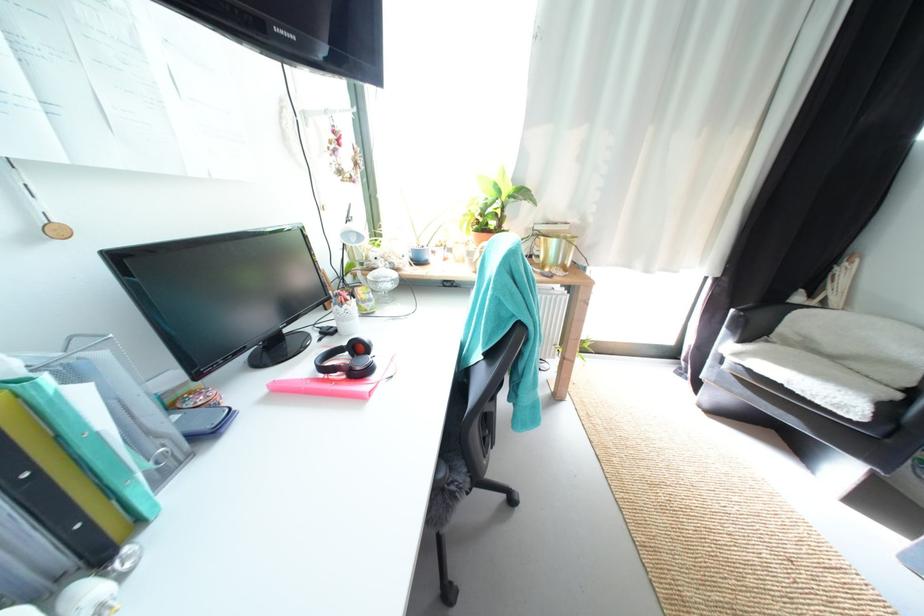
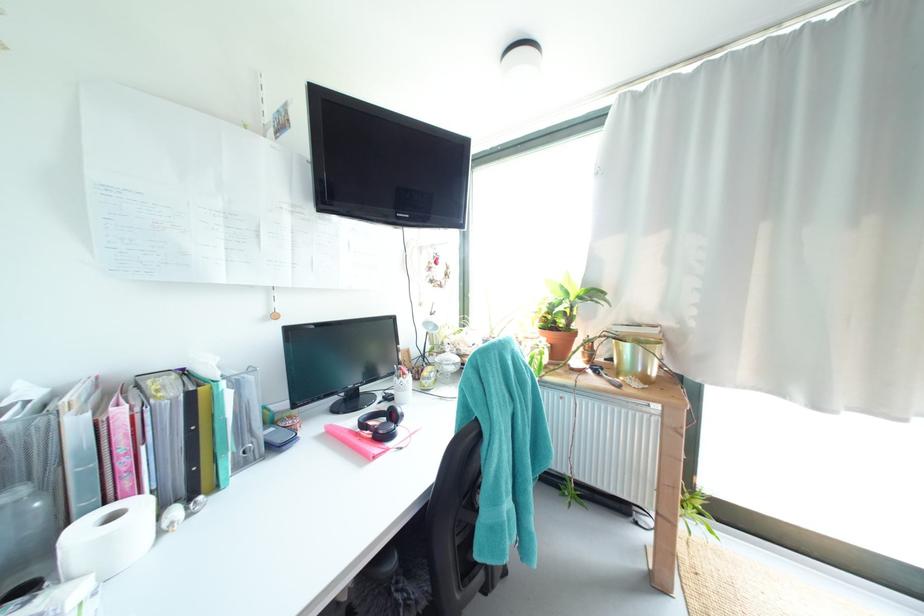
In the second image, find the point that corresponds to pixel 378 278 in the first image.

(445, 361)